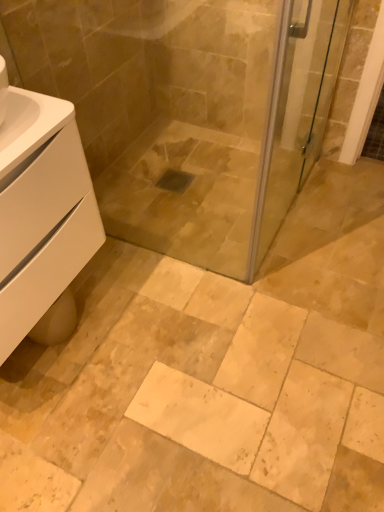
Where is `free spot behind transparent glass screen door at upper right`? free spot behind transparent glass screen door at upper right is located at coordinates (283, 176).